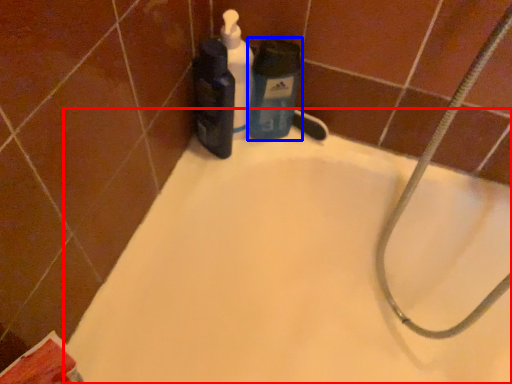
Question: Which of the following is the closest to the observer, bathtub (highlighted by a red box) or cleaning product (highlighted by a blue box)?

Choices:
 (A) bathtub
 (B) cleaning product

Answer: (A)